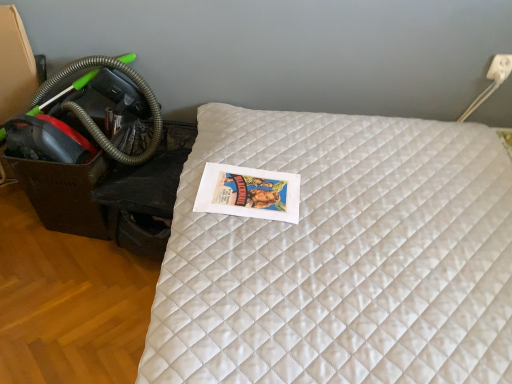
Question: Looking at the image, does white quilted mattress at center seem bigger or smaller compared to white plastic electric outlet at upper right?

Choices:
 (A) big
 (B) small

Answer: (A)

Question: From a real-world perspective, is white quilted mattress at center positioned above or below white plastic electric outlet at upper right?

Choices:
 (A) above
 (B) below

Answer: (B)

Question: Which object is the closest to the green rubber garden hose at left?

Choices:
 (A) white quilted mattress at center
 (B) white plastic electric outlet at upper right

Answer: (A)

Question: Which object is the closest to the white quilted mattress at center?

Choices:
 (A) white plastic electric outlet at upper right
 (B) green rubber garden hose at left

Answer: (B)